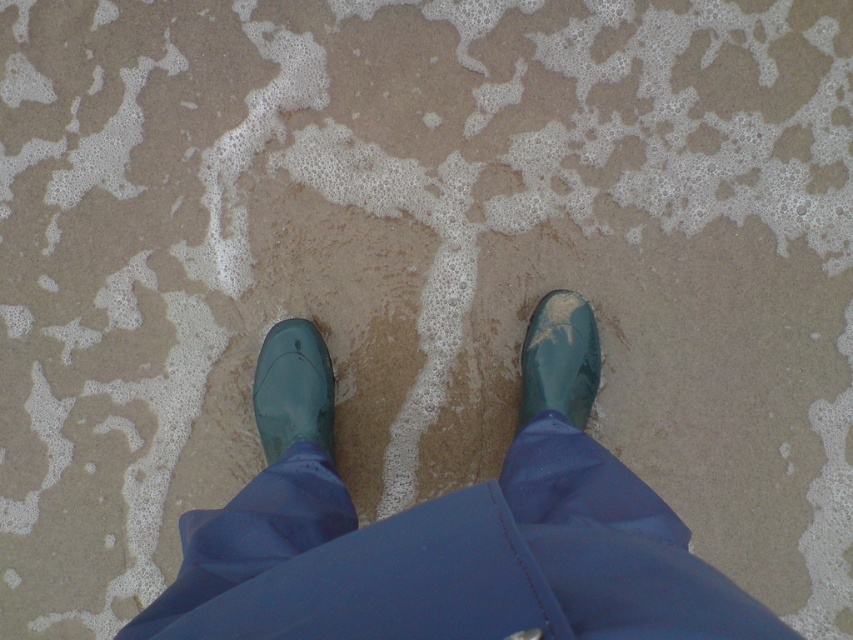
Question: Which is nearer to the glossy rubber boot at lower left?

Choices:
 (A) glossy rubber boot at lower right
 (B) green rubber boots at center

Answer: (B)

Question: Observing the image, what is the correct spatial positioning of green rubber boots at center in reference to glossy rubber boot at lower right?

Choices:
 (A) left
 (B) right

Answer: (A)

Question: Observing the image, what is the correct spatial positioning of glossy rubber boot at lower left in reference to glossy rubber boot at lower right?

Choices:
 (A) below
 (B) above

Answer: (A)

Question: Can you confirm if glossy rubber boot at lower left is positioned above glossy rubber boot at lower right?

Choices:
 (A) yes
 (B) no

Answer: (B)

Question: Which object is positioned farthest from the glossy rubber boot at lower left?

Choices:
 (A) green rubber boots at center
 (B) glossy rubber boot at lower right

Answer: (B)

Question: Considering the real-world distances, which object is farthest from the glossy rubber boot at lower right?

Choices:
 (A) glossy rubber boot at lower left
 (B) green rubber boots at center

Answer: (A)